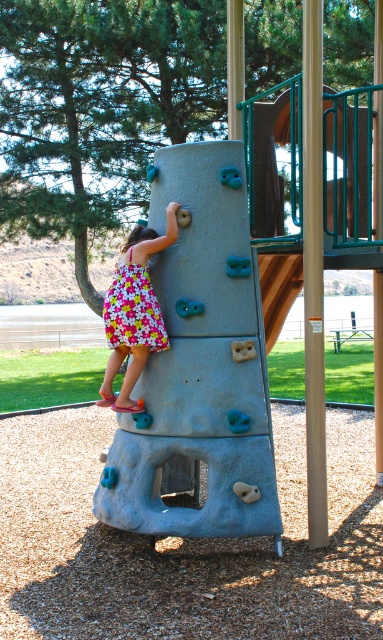
You are a photographer at the playground and want to capture the child in their dress. Given that the floral fabric dress at center is wider than the floral cotton dress at center, which dress should you focus on to ensure the entire dress fits within your camera frame?

The floral fabric dress at center is wider than the floral cotton dress at center, so focusing on the floral fabric dress at center ensures the entire dress fits within the camera frame.

You are standing in front of the rock climbing wall and see two points marked on it. The first point is at coordinates point (126, 269) and the second point is at point (276, 284). Which point is closer to you?

Point (126, 269) is closer to the viewer than point (276, 284).

You are a photographer at the playground and want to capture the child in their dress. Since the two dresses are similar, how can you distinguish the floral fabric dress at center from the floral cotton dress at center based on their appearance?

The floral fabric dress at center is taller than the floral cotton dress at center, so you can identify it by its greater height.